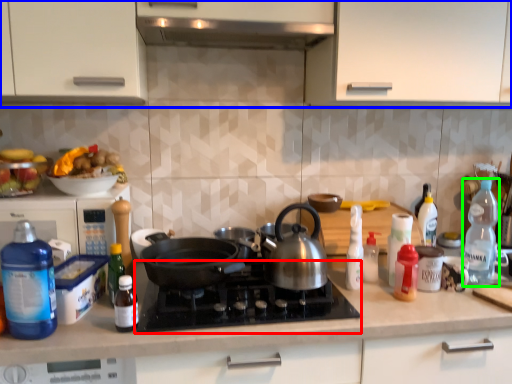
Question: Considering the real-world distances, which object is closest to gas stove (highlighted by a red box)? cabinetry (highlighted by a blue box) or bottle (highlighted by a green box).

Choices:
 (A) cabinetry
 (B) bottle

Answer: (A)